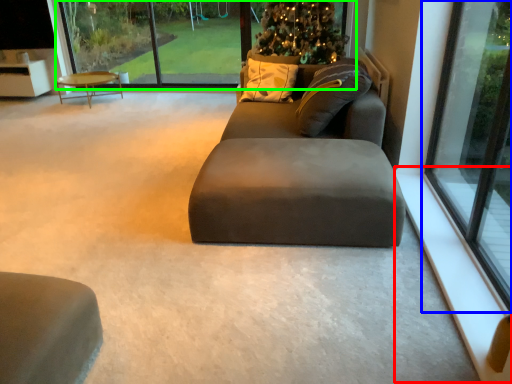
Question: Which is farther away from window sill (highlighted by a red box)? window (highlighted by a blue box) or glass window (highlighted by a green box)?

Choices:
 (A) window
 (B) glass window

Answer: (B)